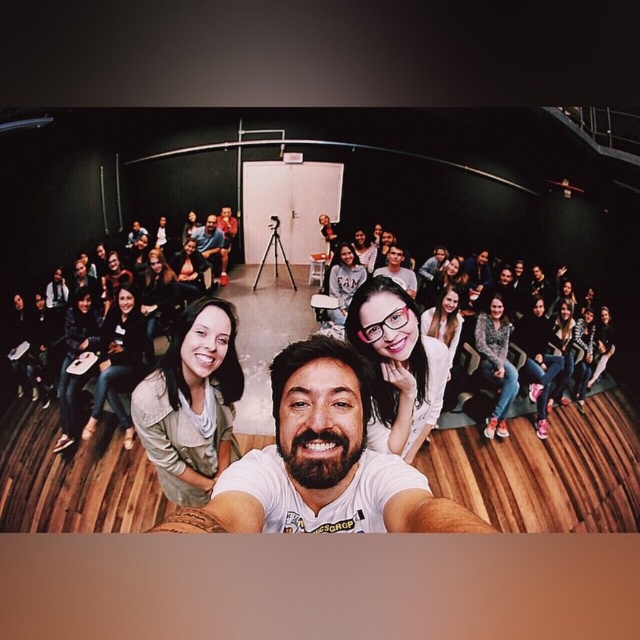
This screenshot has width=640, height=640. In order to click on white matte t-shirt at center in this screenshot , I will do `click(321, 461)`.

Does white matte t-shirt at center have a greater height compared to matte gray shirt at center?

Correct, white matte t-shirt at center is much taller as matte gray shirt at center.

Measure the distance between white matte t-shirt at center and camera.

white matte t-shirt at center and camera are 34.54 inches apart from each other.

Identify the location of white matte t-shirt at center. The width and height of the screenshot is (640, 640). (321, 461).